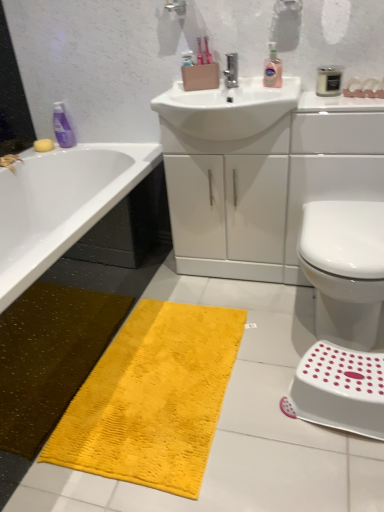
Question: Relative to yellow sponge at upper left, is white matte jar at upper right, which appears as the 1th mouthwash when viewed from the right, in front or behind?

Choices:
 (A) behind
 (B) front

Answer: (B)

Question: Is white matte jar at upper right, the first mouthwash from the front, spatially inside yellow sponge at upper left, or outside of it?

Choices:
 (A) outside
 (B) inside

Answer: (A)

Question: Which object is the closest to the purple glossy mouthwash at upper left, the second mouthwash in the front-to-back sequence?

Choices:
 (A) polished chrome tap at center
 (B) white glossy sink at center
 (C) white matte jar at upper right, the first mouthwash from the front
 (D) white glossy sink at center
 (E) white plastic step stool at lower right

Answer: (A)

Question: Estimate the real-world distances between objects in this image. Which object is farther from the white glossy sink at center?

Choices:
 (A) pink glossy liquid soap at upper center
 (B) yellow plush bath mat at lower center
 (C) white glossy sink at center
 (D) yellow sponge at upper left
 (E) white glossy bidet at lower right

Answer: (D)